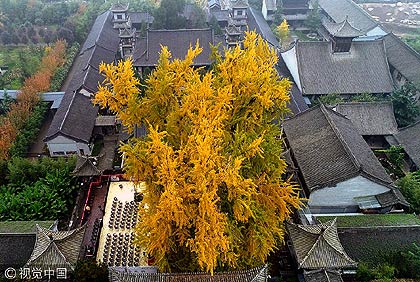
Locate an element on the screen. white wall is located at coordinates (346, 193).